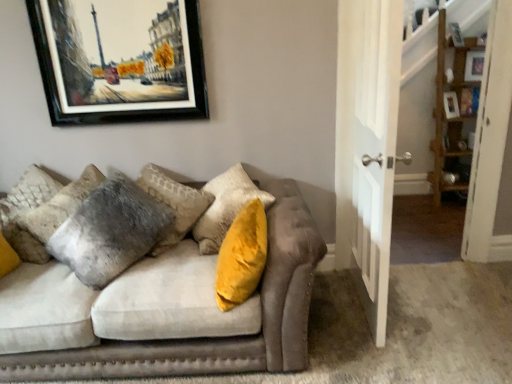
Measure the distance between point (x=383, y=129) and camera.

Point (x=383, y=129) is 6.03 feet away from camera.

Identify the location of white wooden door at center. (374, 148).

The width and height of the screenshot is (512, 384). Describe the element at coordinates (52, 216) in the screenshot. I see `velvet gray pillow at left` at that location.

This screenshot has width=512, height=384. Identify the location of white wooden door at center. (374, 148).

Based on the photo, is velvet gray couch at center inside wooden shelf at right?

No.

This screenshot has width=512, height=384. I want to click on studio couch that is below the wooden shelf at right (from the image's perspective), so pyautogui.click(x=164, y=312).

In terms of size, does wooden shelf at right appear bigger or smaller than velvet gray couch at center?

In the image, wooden shelf at right appears to be smaller than velvet gray couch at center.

Looking at this image, is wooden shelf at right turned away from velvet gray couch at center?

wooden shelf at right does not have its back to velvet gray couch at center.

The height and width of the screenshot is (384, 512). Find the location of `studio couch lying below the wooden shelf at right (from the image's perspective)`. studio couch lying below the wooden shelf at right (from the image's perspective) is located at coordinates (164, 312).

From the image's perspective, is velvet gray couch at center beneath wooden shelf at right?

Yes, from the image's perspective, velvet gray couch at center is beneath wooden shelf at right.

Does velvet gray couch at center have a greater width compared to wooden shelf at right?

Yes, velvet gray couch at center is wider than wooden shelf at right.

How distant is velvet gray couch at center from wooden shelf at right?

A distance of 9.22 feet exists between velvet gray couch at center and wooden shelf at right.

The height and width of the screenshot is (384, 512). I want to click on door below the wooden shelf at right (from a real-world perspective), so click(x=374, y=148).

Does white wooden door at center have a greater height compared to wooden shelf at right?

No, white wooden door at center is not taller than wooden shelf at right.

Considering the positions of points (383, 343) and (460, 162), is point (383, 343) closer to camera compared to point (460, 162)?

Yes.

From a real-world perspective, which is physically below, white wooden door at center or wooden shelf at right?

white wooden door at center.

Would you say velvet gray pillow at left is to the left or to the right of velvet gray couch at center in the picture?

velvet gray pillow at left is to the left of velvet gray couch at center.

From the picture: Which object is closer to the camera, velvet gray pillow at left or velvet gray couch at center?

velvet gray couch at center is in front.

Which point is more distant from viewer, (37,225) or (56,273)?

The point (37,225) is more distant.

From the image's perspective, which one is positioned higher, velvet gray pillow at left or velvet gray couch at center?

velvet gray pillow at left is shown above in the image.

In the scene shown: Could you tell me if black matte picture frame at upper left is turned towards wooden shelf at right?

No, black matte picture frame at upper left is not turned towards wooden shelf at right.

Which of these two, black matte picture frame at upper left or wooden shelf at right, stands shorter?

black matte picture frame at upper left is shorter.

Would you say black matte picture frame at upper left is outside wooden shelf at right?

Absolutely, black matte picture frame at upper left is external to wooden shelf at right.

Is black matte picture frame at upper left behind wooden shelf at right?

No, black matte picture frame at upper left is in front of wooden shelf at right.

Looking at the image, does velvet gray pillow at left seem bigger or smaller compared to wooden shelf at right?

In the image, velvet gray pillow at left appears to be smaller than wooden shelf at right.

Is velvet gray pillow at left turned away from wooden shelf at right?

No, wooden shelf at right is not at the back of velvet gray pillow at left.

Where is `shelf located above the velvet gray pillow at left (from a real-world perspective)`? shelf located above the velvet gray pillow at left (from a real-world perspective) is located at coordinates (453, 112).

Is wooden shelf at right turned away from black matte picture frame at upper left?

wooden shelf at right is not turned away from black matte picture frame at upper left.

Which is less distant, (452, 123) or (139, 114)?

Point (452, 123) is farther from the camera than point (139, 114).

From the image's perspective, is wooden shelf at right located beneath black matte picture frame at upper left?

Actually, wooden shelf at right appears above black matte picture frame at upper left in the image.

What's the angular difference between wooden shelf at right and black matte picture frame at upper left's facing directions?

The facing directions of wooden shelf at right and black matte picture frame at upper left are 0.351 degrees apart.

Identify the location of studio couch located on the left of wooden shelf at right. This screenshot has width=512, height=384. (164, 312).

In the image, there is a wooden shelf at right. At what (x,y) coordinates should I click in order to perform the action: click on studio couch below it (from a real-world perspective). Please return your answer as a coordinate pair (x, y). Image resolution: width=512 pixels, height=384 pixels. Looking at the image, I should click on (164, 312).

From the picture: Based on their spatial positions, is white wooden door at center or velvet gray pillow at left further from wooden shelf at right?

The object further to wooden shelf at right is velvet gray pillow at left.

Looking at the image, which one is located further to black matte picture frame at upper left, wooden shelf at right or velvet gray pillow at left?

wooden shelf at right is further to black matte picture frame at upper left.

Considering their positions, is velvet gray pillow at left positioned further to white wooden door at center than black matte picture frame at upper left?

Among the two, velvet gray pillow at left is located further to white wooden door at center.

Which object lies nearer to the anchor point velvet gray pillow at left, white wooden door at center or wooden shelf at right?

Among the two, white wooden door at center is located nearer to velvet gray pillow at left.

Considering their positions, is white wooden door at center positioned closer to wooden shelf at right than black matte picture frame at upper left?

Based on the image, white wooden door at center appears to be nearer to wooden shelf at right.

Based on their spatial positions, is black matte picture frame at upper left or white wooden door at center further from velvet gray pillow at left?

white wooden door at center lies further to velvet gray pillow at left than the other object.

From the image, which object appears to be farther from black matte picture frame at upper left, velvet gray couch at center or velvet gray pillow at left?

Among the two, velvet gray couch at center is located further to black matte picture frame at upper left.

When comparing their distances from black matte picture frame at upper left, does wooden shelf at right or white wooden door at center seem closer?

white wooden door at center is positioned closer to the anchor black matte picture frame at upper left.

Find the location of a particular element. This screenshot has width=512, height=384. door between velvet gray couch at center and wooden shelf at right is located at coordinates point(374,148).

Find the location of a particular element. studio couch situated between black matte picture frame at upper left and white wooden door at center from left to right is located at coordinates (164, 312).

Find the location of a particular element. This screenshot has width=512, height=384. picture frame situated between velvet gray pillow at left and wooden shelf at right from left to right is located at coordinates (121, 68).

You are a GUI agent. You are given a task and a screenshot of the screen. Output one action in this format:
    pyautogui.click(x=<x>, y=<y>)
    Task: Click on the door between velvet gray pillow at left and wooden shelf at right in the horizontal direction
    
    Given the screenshot: What is the action you would take?
    pyautogui.click(x=374, y=148)